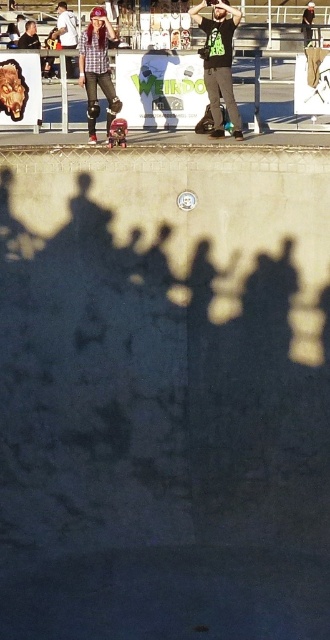
From the picture: You are a photographer aiming to capture a clear photo of the matte plaid shirt at center and the metallic pink skateboard at center. Which object will appear closer to the camera in the photo?

The matte plaid shirt at center will appear closer to the camera in the photo because it is positioned in front of the metallic pink skateboard at center.

You are standing at point (x=238, y=136) in the skatepark. You want to take a photo of the camera. Is the camera within your reach to take a photo?

The distance between point (x=238, y=136) and the camera is 11.11 meters. Since the distance is too far, you cannot reach the camera to take a photo.

You are a photographer trying to capture a group photo of the green matte shirt at upper center and the matte black shirt at upper left. Since you want both subjects to appear balanced in the frame, which person should you position closer to the camera?

The matte black shirt at upper left should be positioned closer to the camera because it is smaller in size compared to the green matte shirt at upper center, so moving it forward will help balance their sizes in the photo.